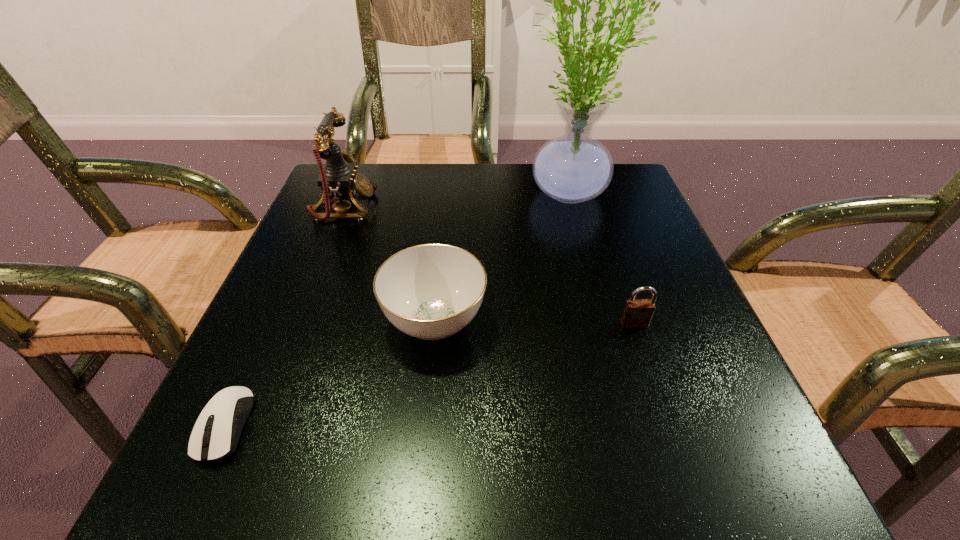
Identify the location of the tallest object. (573, 168).

The height and width of the screenshot is (540, 960). Find the location of `telephone`. telephone is located at coordinates (338, 180).

Locate an element on the screen. Image resolution: width=960 pixels, height=540 pixels. chinaware is located at coordinates (431, 291).

I want to click on padlock, so click(x=637, y=313).

Locate an element on the screen. the nearest object is located at coordinates (218, 441).

Identify the location of mouse. This screenshot has height=540, width=960. (218, 441).

I want to click on free location located on the left of the flower arrangement, so click(x=460, y=194).

The height and width of the screenshot is (540, 960). Identify the location of vacant space situated on the front of the telephone, featuring the rotary dial. (527, 208).

Where is `free space located 0.120m on the back of the third object from right to left`? The width and height of the screenshot is (960, 540). free space located 0.120m on the back of the third object from right to left is located at coordinates (443, 244).

Where is `free spot located on the front-facing side of the padlock`? This screenshot has width=960, height=540. free spot located on the front-facing side of the padlock is located at coordinates (660, 404).